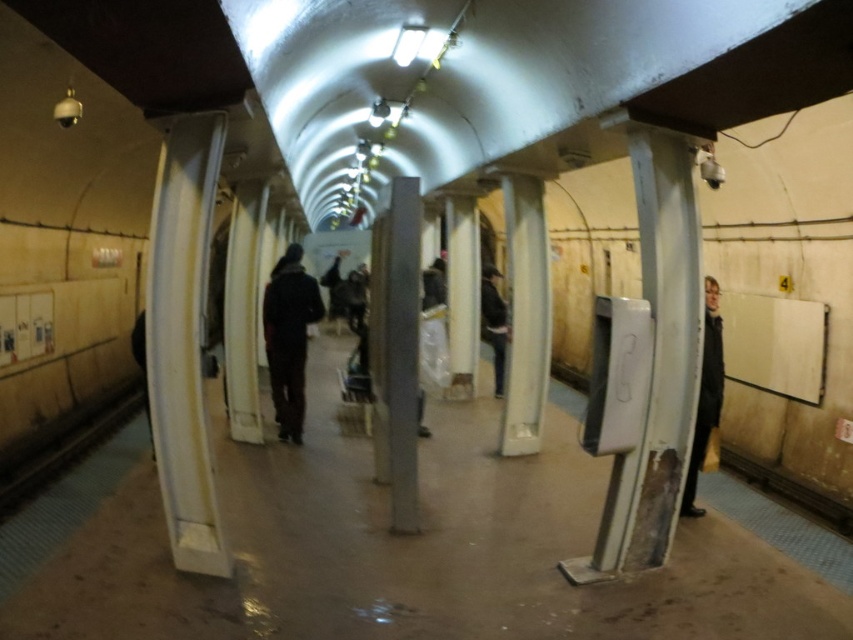
You are a delivery person carrying a large box that measures 5 feet in width. You need to walk through the subway station platform and pass between the black leather jacket at right and the dark brown leather jacket at center. Can you fit through the space between them?

The black leather jacket at right is 10.61 feet from the dark brown leather jacket at center, so the space between them is 10.61 feet wide. Since your box is only 5 feet wide, you can easily fit through the space between the black leather jacket at right and the dark brown leather jacket at center.

You are a delivery person carrying a package that requires a 3 meter clearance to pass safely. You need to navigate between the dark gray fabric jacket at center and the black leather jacket at right. Can you safely pass through the space between them without hitting the package?

The distance between the dark gray fabric jacket at center and the black leather jacket at right is 2.84 meters. Since the required clearance is 3 meters, the package cannot safely pass through this space as it is 0.16 meters too narrow.

You are a commuter waiting for the train and notice two jackets hanging on a pillar. The jackets are the black leather jacket at right and the dark brown leather jacket at center. Which jacket is shorter in height?

The black leather jacket at right has a lesser height compared to the dark brown leather jacket at center, so the black leather jacket at right is shorter.